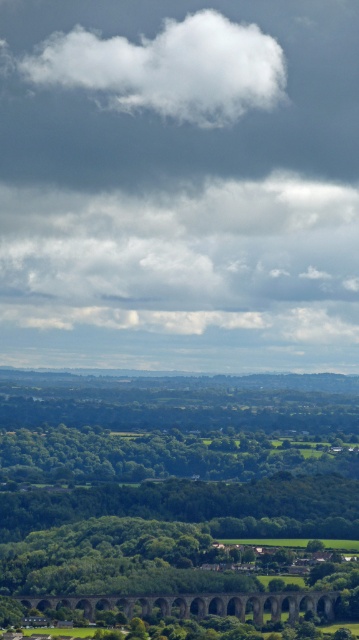
Which is in front, point (290, 452) or point (197, 74)?

Positioned in front is point (290, 452).

Does green grassy field at lower center appear over white fluffy cloud at upper center?

Incorrect, green grassy field at lower center is not positioned above white fluffy cloud at upper center.

Which is in front, point (221, 531) or point (90, 67)?

Point (221, 531)

Find the location of `green grassy field at lower center`. green grassy field at lower center is located at coordinates (165, 484).

Is green grassy field at lower center to the right of brown stone viaduct at lower center from the viewer's perspective?

Indeed, green grassy field at lower center is positioned on the right side of brown stone viaduct at lower center.

Is point (230, 554) behind point (296, 611)?

No, (230, 554) is closer to viewer.

At what (x,y) coordinates should I click in order to perform the action: click on green grassy field at lower center. Please return your answer as a coordinate pair (x, y). The width and height of the screenshot is (359, 640). Looking at the image, I should click on (165, 484).

Between point (103, 52) and point (67, 596), which one is positioned behind?

The point (103, 52) is behind.

Who is more forward, (63, 51) or (142, 600)?

Point (142, 600) is in front.

Find the location of a particular element. white fluffy cloud at upper center is located at coordinates (169, 68).